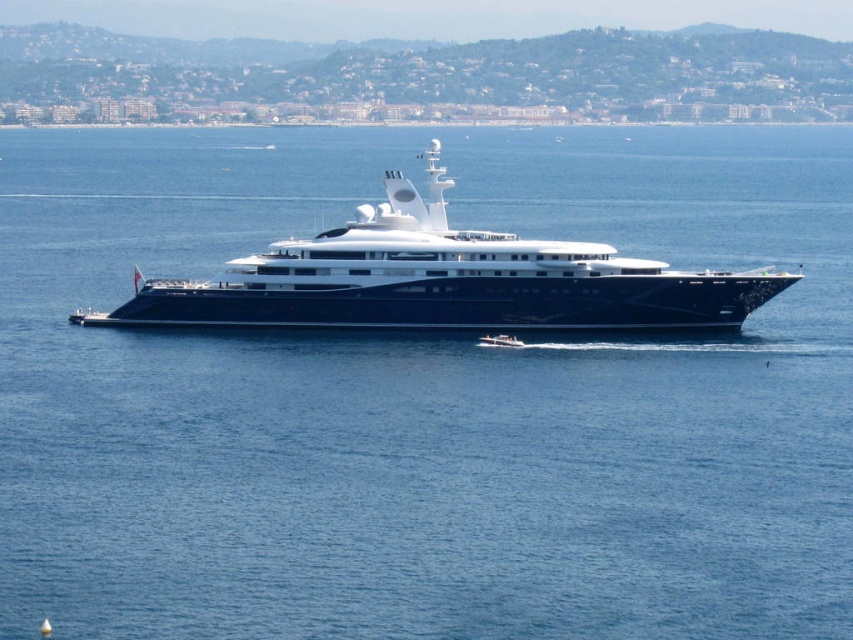
You are a photographer on the white glossy cruise ship at center trying to capture the white glossy speedboat at center with your camera. The speedboat is moving away from the cruise ship. If the cruise ship is stationary, will the speedboat appear smaller or larger in the photo compared to when it was closer?

The white glossy cruise ship at center is bigger than the white glossy speedboat at center. Since the speedboat is moving away from the cruise ship, it will appear smaller in the photo compared to when it was closer.

You are a drone operator trying to capture a photo of the white glossy cruise ship at center from above. The drone has a maximum flight range of 100 meters. Given that the drone is currently at point 0,0, can it reach the cruise ship?

The white glossy cruise ship at center is located at point [444,280]. The distance between the drone at [0,0] and the ship is sqrt0.439 squared plus 0.521 squared, which is approximately sqrt0.192 plus 0.271 equals sqrt0.463 equals approximately 0.68 meters. Since the drone can fly up to 100 meters, it can easily reach the cruise ship.